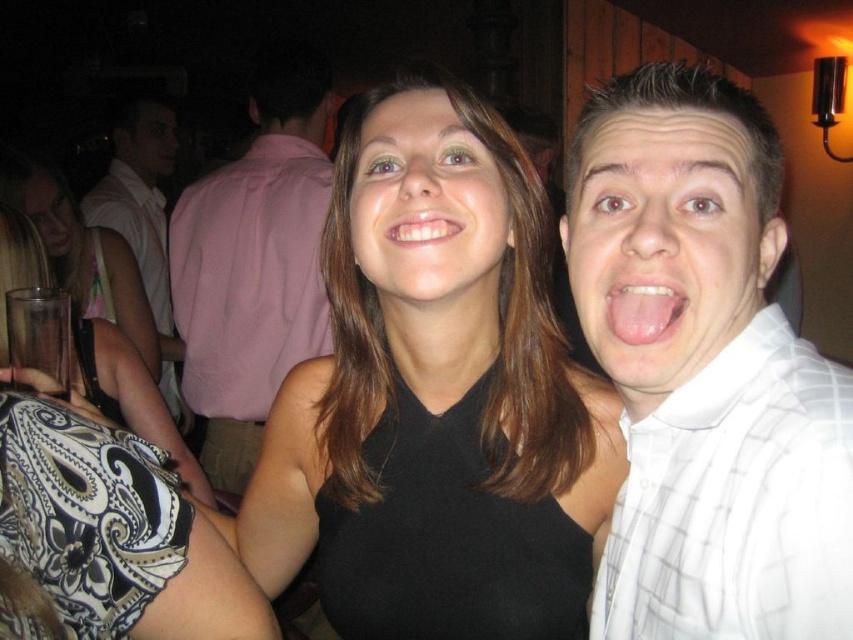
Can you confirm if white checkered shirt at right is wider than white glossy teeth at center?

Indeed, white checkered shirt at right has a greater width compared to white glossy teeth at center.

Does point (776, 436) lie in front of point (415, 212)?

Yes, point (776, 436) is closer to viewer.

The image size is (853, 640). Identify the location of white checkered shirt at right. (706, 374).

Is point (709, 218) more distant than point (61, 232)?

No.

Between white glossy face at center right and clear plastic cup at left, which one appears on the right side from the viewer's perspective?

Positioned to the right is white glossy face at center right.

This screenshot has width=853, height=640. Find the location of `white glossy face at center right`. white glossy face at center right is located at coordinates (665, 243).

Where is `white glossy face at center right`? This screenshot has width=853, height=640. white glossy face at center right is located at coordinates (665, 243).

Does pink cotton shirt at upper left appear on the right side of white glossy teeth at center?

Incorrect, pink cotton shirt at upper left is not on the right side of white glossy teeth at center.

Who is lower down, pink cotton shirt at upper left or white glossy teeth at center?

white glossy teeth at center is lower down.

Does point (173, 259) lie in front of point (427, 232)?

No, (173, 259) is behind (427, 232).

What are the coordinates of `pink cotton shirt at upper left` in the screenshot? It's located at (254, 262).